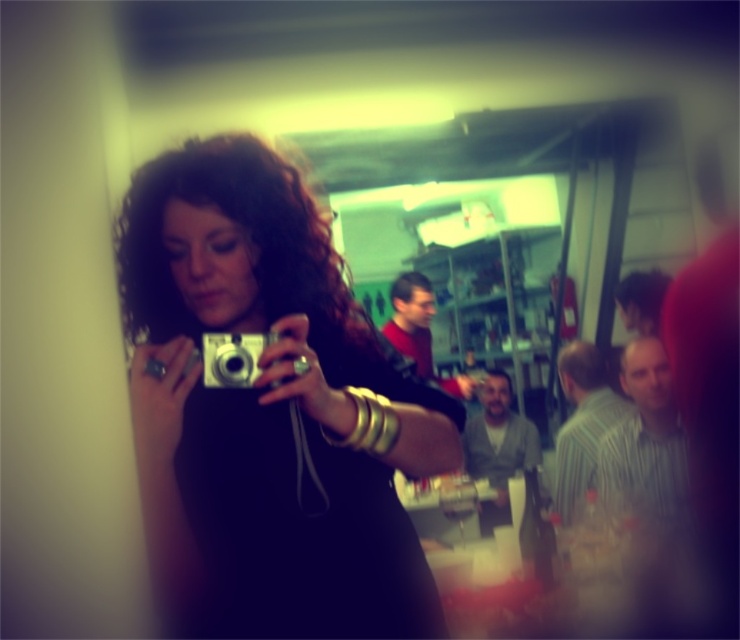
You are at a party and want to take a photo of yourself using the silver metallic camera at center. However, you notice the matte black dress at center is in the way. Can you adjust your position so that the camera is above the dress to avoid obstruction?

Yes, since the matte black dress at center is below the silver metallic camera at center, adjusting your position to ensure the camera remains above the dress will prevent obstruction.

In the scene shown: You are organizing a photoshoot and need to place the matte black dress at center and the silver metallic camera at center on a table. Based on their sizes, which object will require more space horizontally?

The matte black dress at center requires more horizontal space because its width surpasses that of the silver metallic camera at center.